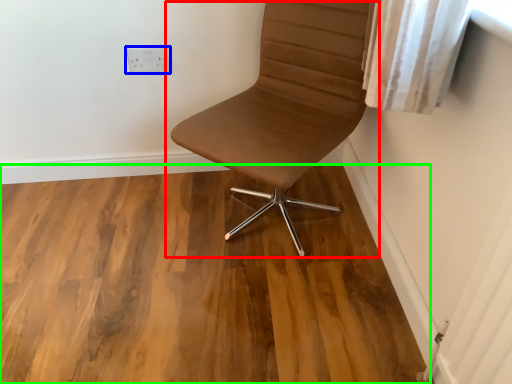
Question: Estimate the real-world distances between objects in this image. Which object is farther from chair (highlighted by a red box), electric outlet (highlighted by a blue box) or hardwood (highlighted by a green box)?

Choices:
 (A) electric outlet
 (B) hardwood

Answer: (A)